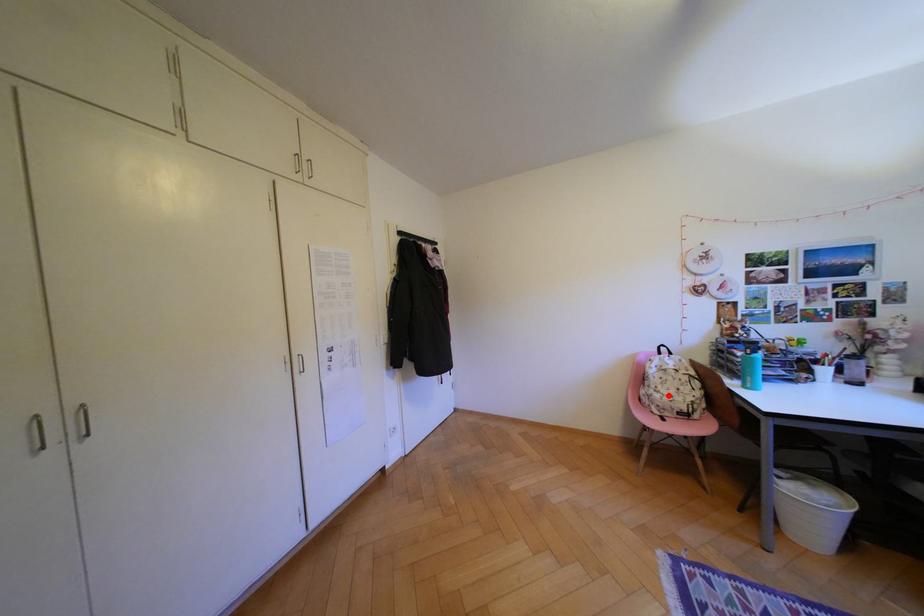
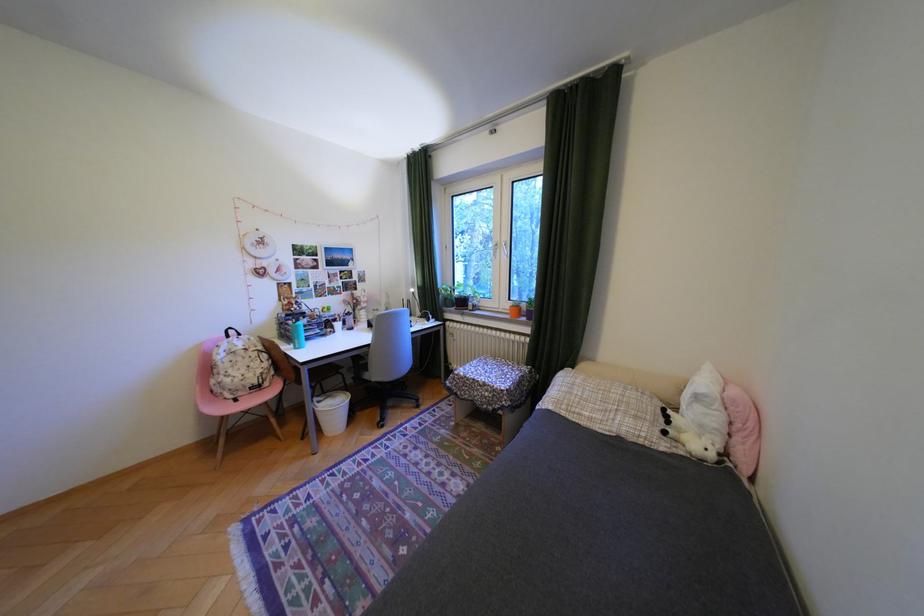
The point at the highlighted location is marked in the first image. Where is the corresponding point in the second image?

(239, 379)